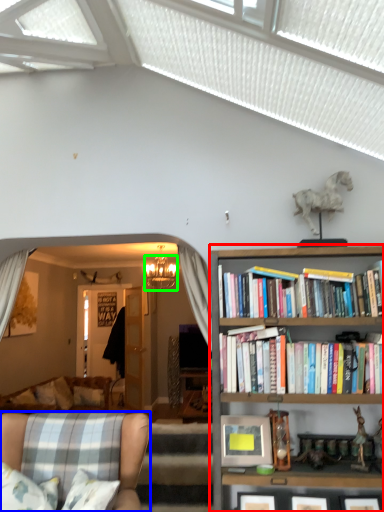
Question: Which object is the farthest from bookcase (highlighted by a red box)? Choose among these: chair (highlighted by a blue box) or lamp (highlighted by a green box).

Choices:
 (A) chair
 (B) lamp

Answer: (B)